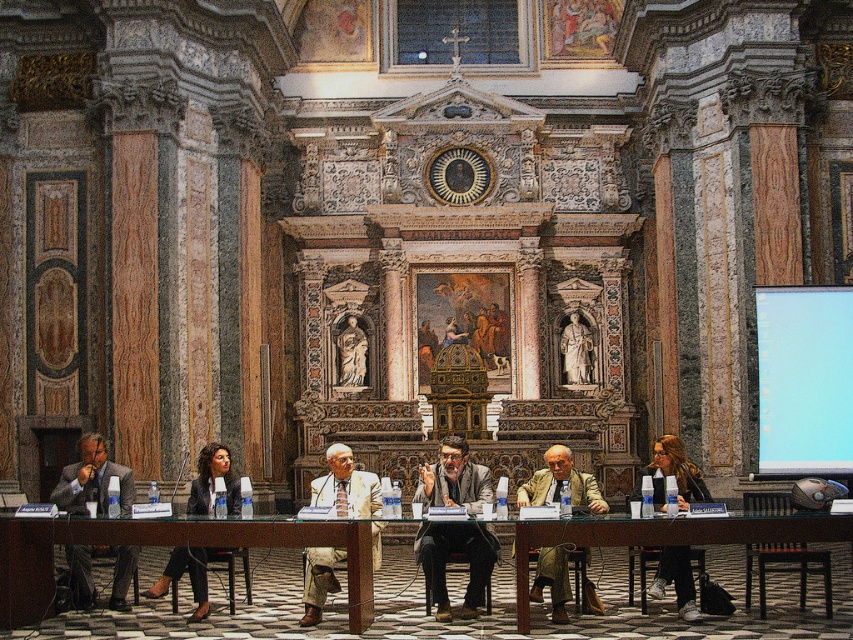
Question: Is the position of wooden polished table at lower right more distant than that of light beige suit at center?

Choices:
 (A) no
 (B) yes

Answer: (A)

Question: Which is nearer to the brown wooden table at center?

Choices:
 (A) light beige suit at center
 (B) glass table at center

Answer: (A)

Question: Is light blue glossy projector screen at right to the left of dark brown leather jacket at lower right from the viewer's perspective?

Choices:
 (A) no
 (B) yes

Answer: (A)

Question: Estimate the real-world distances between objects in this image. Which object is farther from the wooden polished table at lower right?

Choices:
 (A) black leather pants at lower left
 (B) matte gray suit at left
 (C) marble statue at center

Answer: (C)

Question: Is khaki corduroy pants at center thinner than marble statue at center?

Choices:
 (A) yes
 (B) no

Answer: (B)

Question: Which object is farther from the camera taking this photo?

Choices:
 (A) dark brown leather jacket at lower right
 (B) light blue glossy projector screen at right

Answer: (B)